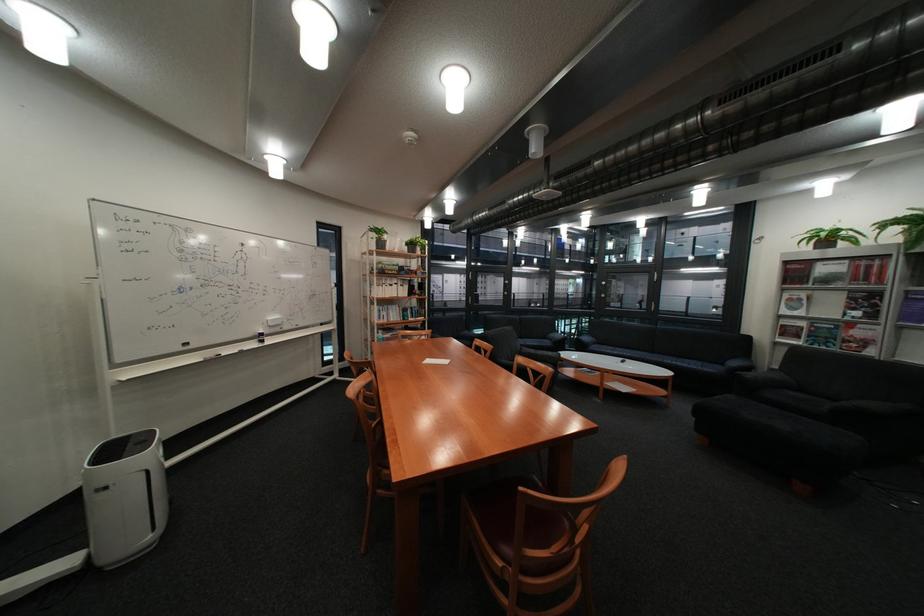
The image size is (924, 616). What do you see at coordinates (495, 546) in the screenshot? I see `a chair armrest` at bounding box center [495, 546].